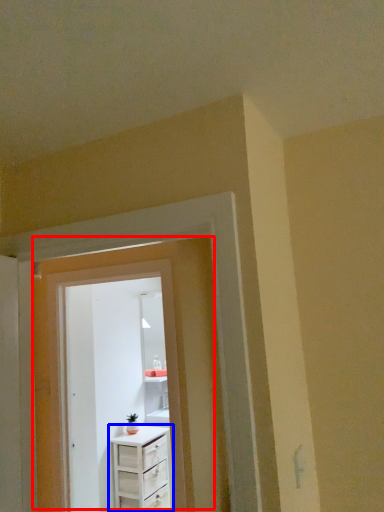
Question: Which object appears closest to the camera in this image, door (highlighted by a red box) or chest of drawers (highlighted by a blue box)?

Choices:
 (A) door
 (B) chest of drawers

Answer: (A)